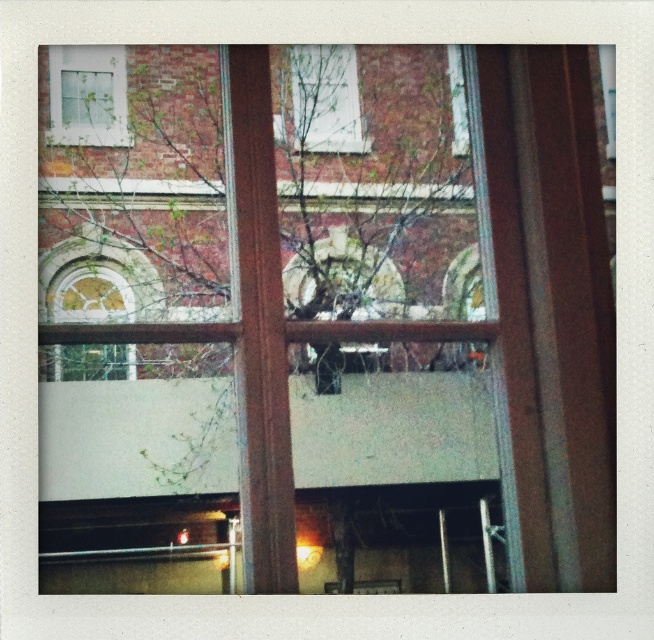
You are an interior designer assessing the view from this window. The green leafy tree at center and the white matte window at upper left are both visible. Which object is wider in the current view?

The green leafy tree at center might be wider than white matte window at upper left.

From the picture: You are standing in a room looking through the window. There is a point marked at coordinates (264, 280). What object is located at that point?

The point at coordinates (264, 280) is occupied by the green leafy tree at center.